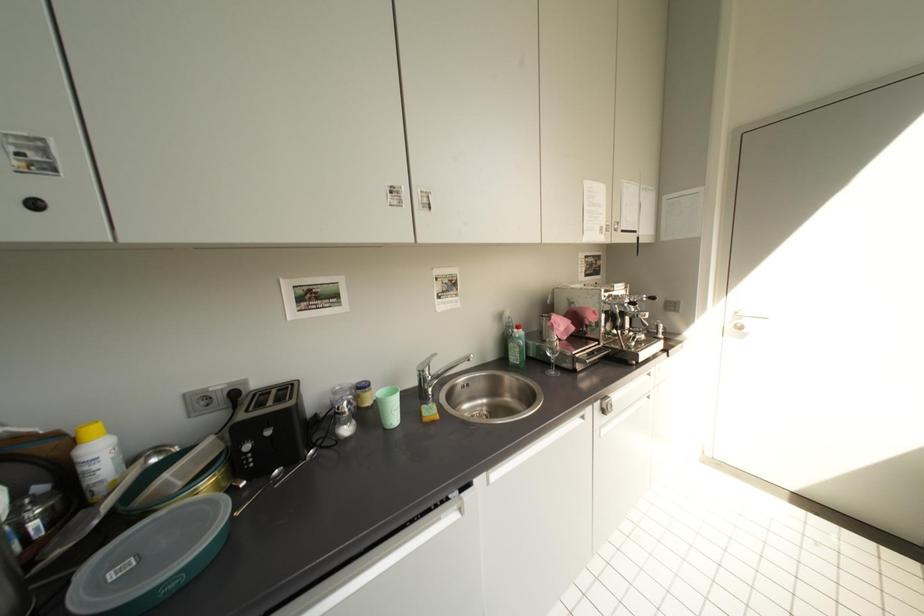
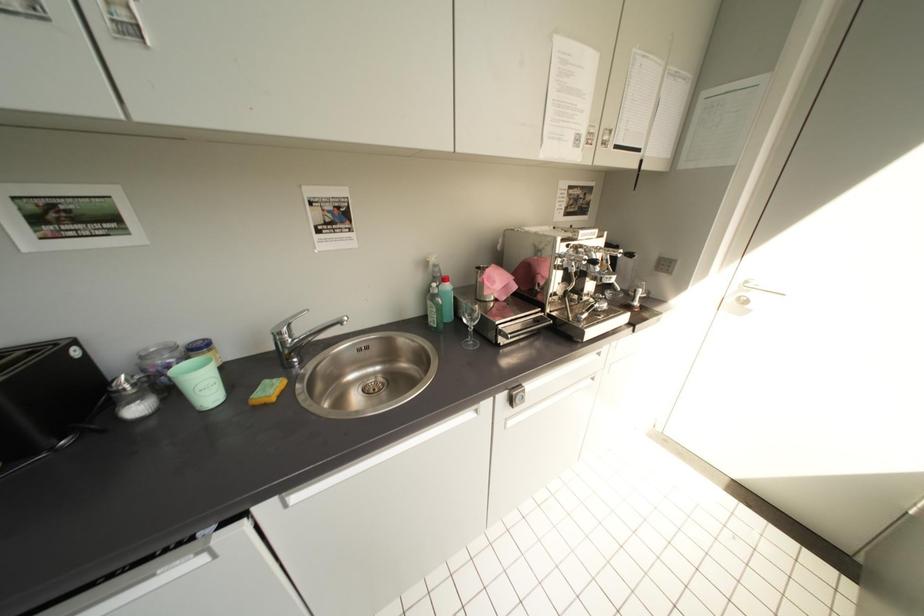
Question: How did the camera likely rotate?

Choices:
 (A) Left
 (B) Right
 (C) Up
 (D) Down

Answer: (D)